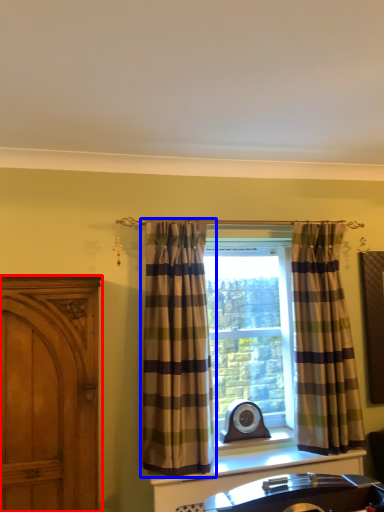
Question: Which object appears farthest to the camera in this image, cabinetry (highlighted by a red box) or curtain (highlighted by a blue box)?

Choices:
 (A) cabinetry
 (B) curtain

Answer: (B)